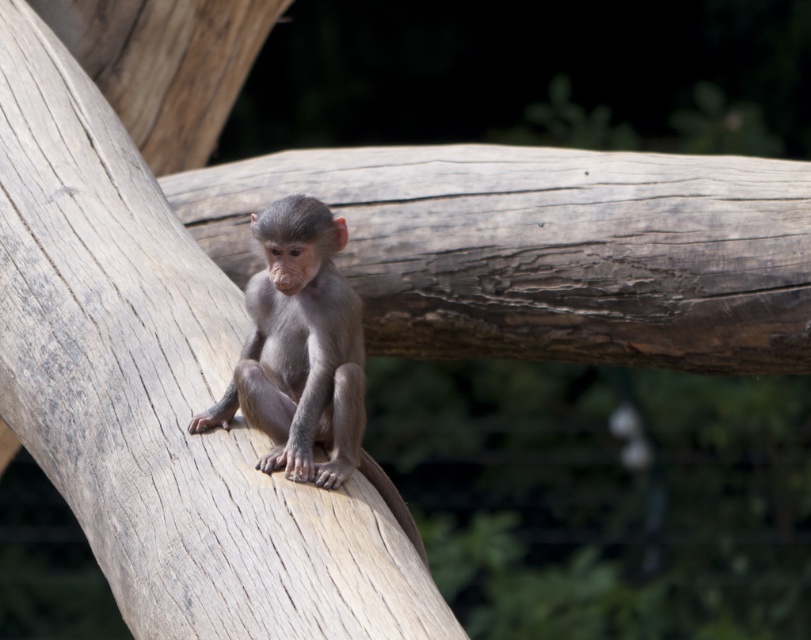
You are a zookeeper trying to place a banana between the two points, point 1 at point (50, 88) and point 2 at point (247, 384). Which point is closer to you so you can place the banana there first?

Point (50, 88) is closer to you than point (247, 384), so you can place the banana there first.

You are a zookeeper trying to place a new feeding tray for the monkey. The tray requires a flat surface that is at least 0.2 meters in height. Given the coordinates provided in the description, can the gray textured log at center support the feeding tray?

The gray textured log at center is located at point [161,392]. Since the y coordinate 0.199 is approximately 0.2 meters, the log is at the required height. Therefore, the feeding tray can be placed there.

You are a zookeeper who needs to ensure the monkey stays within the exhibit. The gray textured log at center and the gray furry monkey at center are both in the center of the exhibit. Given their sizes, which object takes up more space in the center area?

The gray textured log at center has a larger size compared to the gray furry monkey at center, so it takes up more space in the center area.